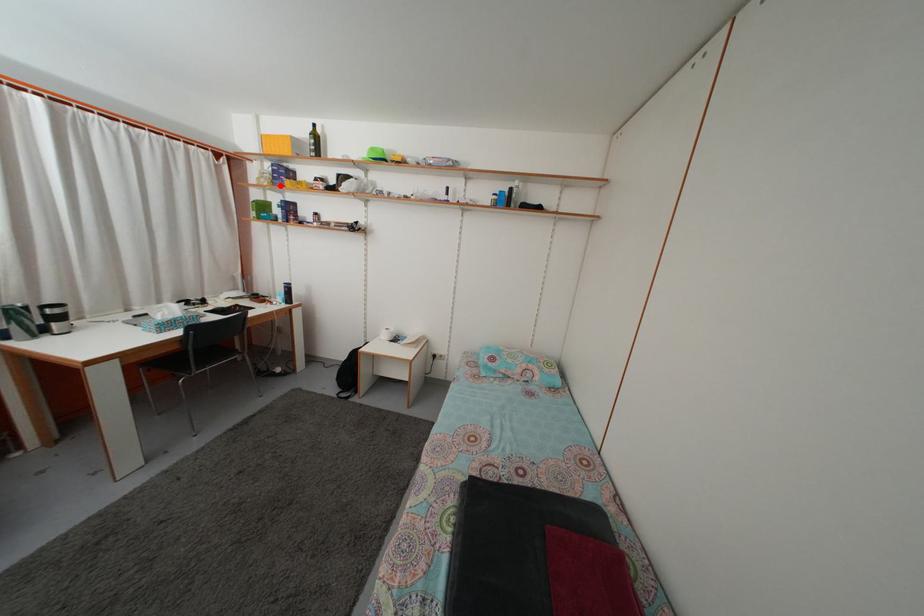
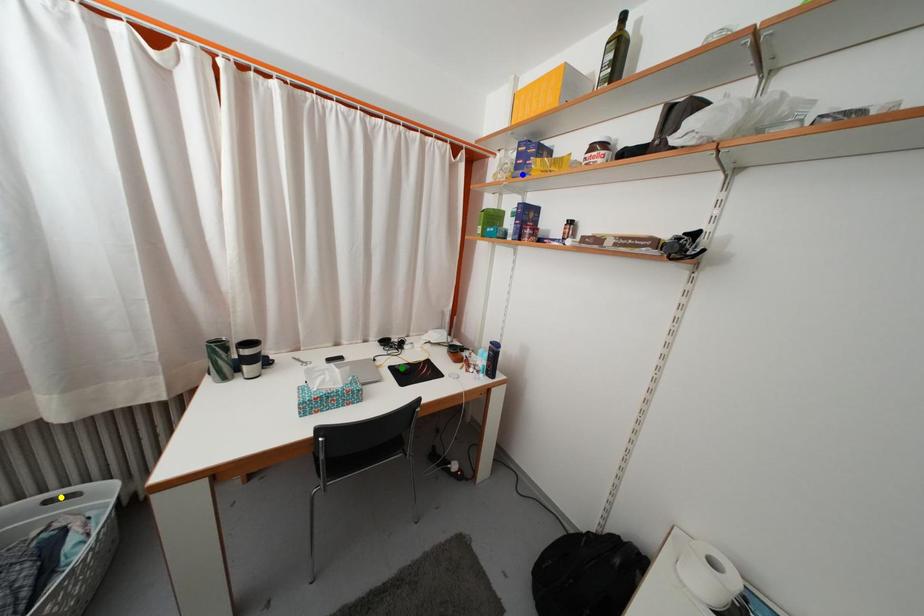
Question: I am providing you with two images of the same scene from different viewpoints. A red point is marked on the first image. You are given multiple points on the second image. Can you choose the point in image 2 that corresponds to the point in image 1?

Choices:
 (A) yellow point
 (B) green point
 (C) blue point

Answer: (C)